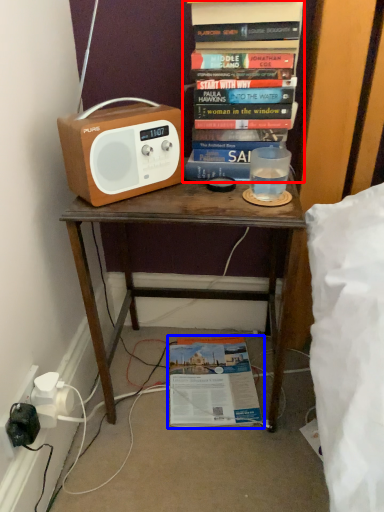
Question: Which point is further to the camera, book (highlighted by a red box) or book (highlighted by a blue box)?

Choices:
 (A) book
 (B) book

Answer: (B)